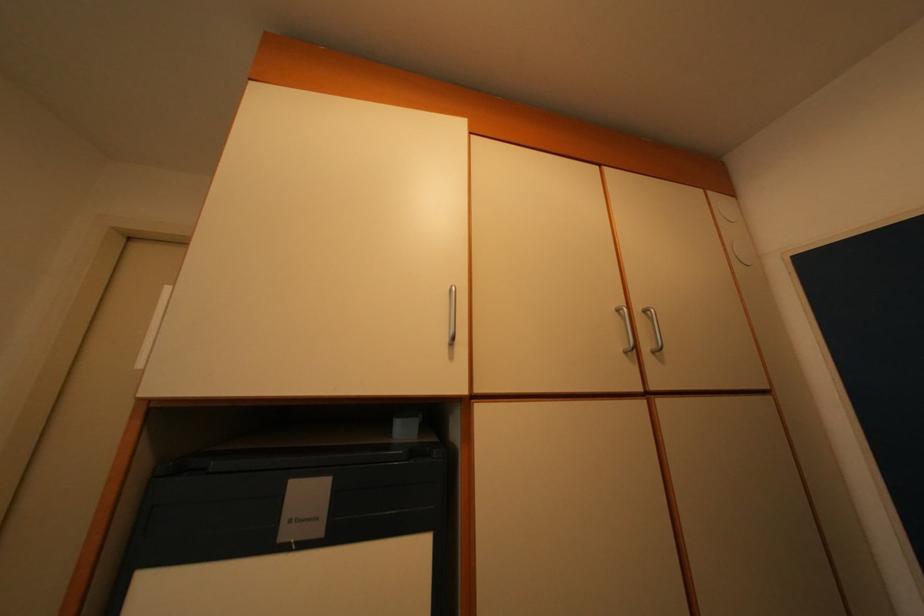
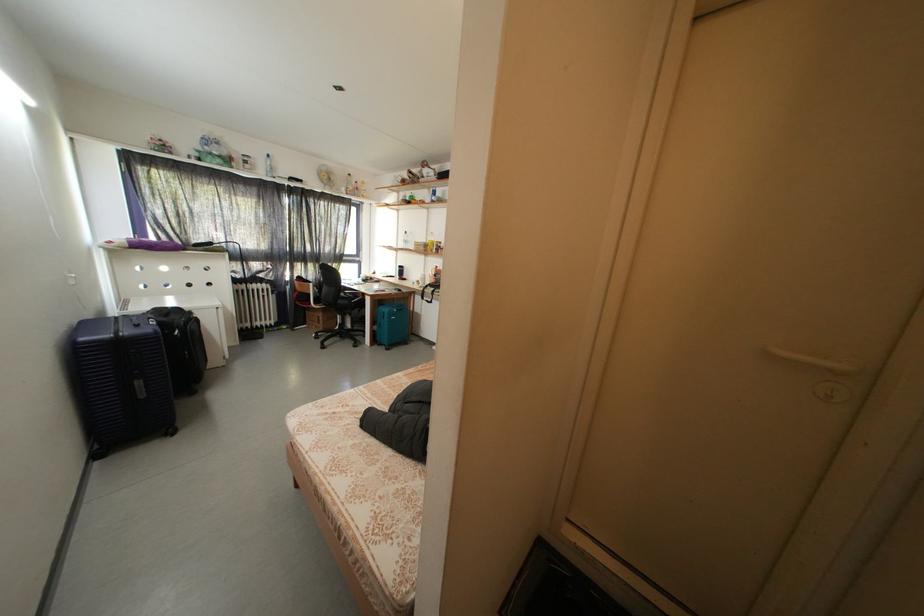
First-person continuous shooting, in which direction is the camera rotating?

The camera's rotation is toward left-down.